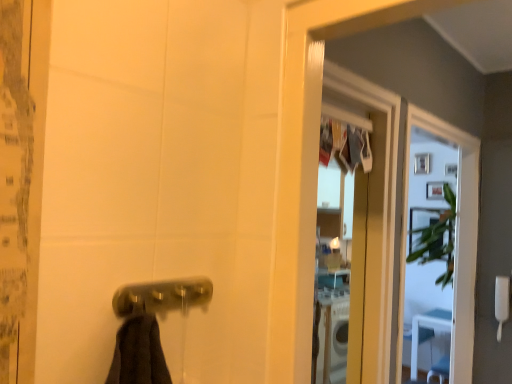
Question: Can you confirm if clear glass screen door at upper right is taller than polished brass door handle at lower center?

Choices:
 (A) no
 (B) yes

Answer: (B)

Question: Is clear glass screen door at upper right aimed at polished brass door handle at lower center?

Choices:
 (A) no
 (B) yes

Answer: (A)

Question: From the image's perspective, is clear glass screen door at upper right under polished brass door handle at lower center?

Choices:
 (A) no
 (B) yes

Answer: (B)

Question: Is the depth of clear glass screen door at upper right greater than that of polished brass door handle at lower center?

Choices:
 (A) yes
 (B) no

Answer: (A)

Question: Does clear glass screen door at upper right have a lesser height compared to polished brass door handle at lower center?

Choices:
 (A) no
 (B) yes

Answer: (A)

Question: Considering the relative positions of white plastic towel bar at lower left and polished brass door handle at lower center in the image provided, is white plastic towel bar at lower left to the left or to the right of polished brass door handle at lower center?

Choices:
 (A) left
 (B) right

Answer: (B)

Question: Would you say white plastic towel bar at lower left is inside or outside polished brass door handle at lower center?

Choices:
 (A) outside
 (B) inside

Answer: (A)

Question: From the image's perspective, is white plastic towel bar at lower left positioned above or below polished brass door handle at lower center?

Choices:
 (A) below
 (B) above

Answer: (A)

Question: Considering their positions, is white plastic towel bar at lower left located in front of or behind polished brass door handle at lower center?

Choices:
 (A) front
 (B) behind

Answer: (B)

Question: Relative to clear glass screen door at upper right, is polished brass door handle at lower center in front or behind?

Choices:
 (A) behind
 (B) front

Answer: (B)

Question: Looking at the image, does polished brass door handle at lower center seem bigger or smaller compared to clear glass screen door at upper right?

Choices:
 (A) big
 (B) small

Answer: (B)

Question: In terms of height, does polished brass door handle at lower center look taller or shorter compared to clear glass screen door at upper right?

Choices:
 (A) tall
 (B) short

Answer: (B)

Question: Is point (203, 289) closer or farther from the camera than point (396, 364)?

Choices:
 (A) farther
 (B) closer

Answer: (B)

Question: Is point (499, 284) closer or farther from the camera than point (458, 324)?

Choices:
 (A) farther
 (B) closer

Answer: (B)

Question: Considering the positions of white plastic towel bar at lower left and clear glass screen door at upper right in the image, is white plastic towel bar at lower left taller or shorter than clear glass screen door at upper right?

Choices:
 (A) short
 (B) tall

Answer: (A)